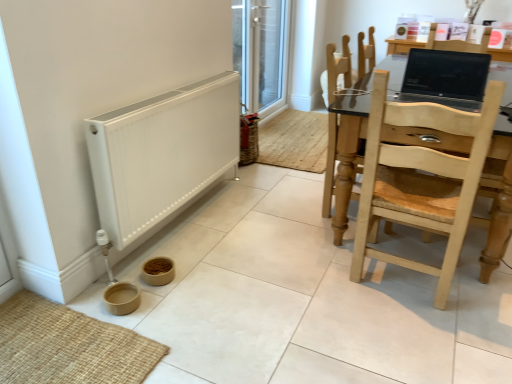
Question: Considering the positions of transparent glass screen door at upper center and light wood chair at right, the second chair from the back, in the image, is transparent glass screen door at upper center bigger or smaller than light wood chair at right, the second chair from the back,?

Choices:
 (A) small
 (B) big

Answer: (A)

Question: Is point (282, 56) closer or farther from the camera than point (368, 134)?

Choices:
 (A) closer
 (B) farther

Answer: (B)

Question: Estimate the real-world distances between objects in this image. Which object is closer to the transparent glass screen door at upper center?

Choices:
 (A) light wood chair at right, the second chair from the back
 (B) matte black laptop at upper right
 (C) light brown wooden chair at right, which appears as the 1th chair when viewed from the back
 (D) white matte heater at lower left

Answer: (C)

Question: Which is farther from the transparent glass screen door at upper center?

Choices:
 (A) light brown wooden chair at right, which is the 2th chair from front to back
 (B) light wood chair at right, the second chair from the back
 (C) matte black laptop at upper right
 (D) white matte heater at lower left

Answer: (B)